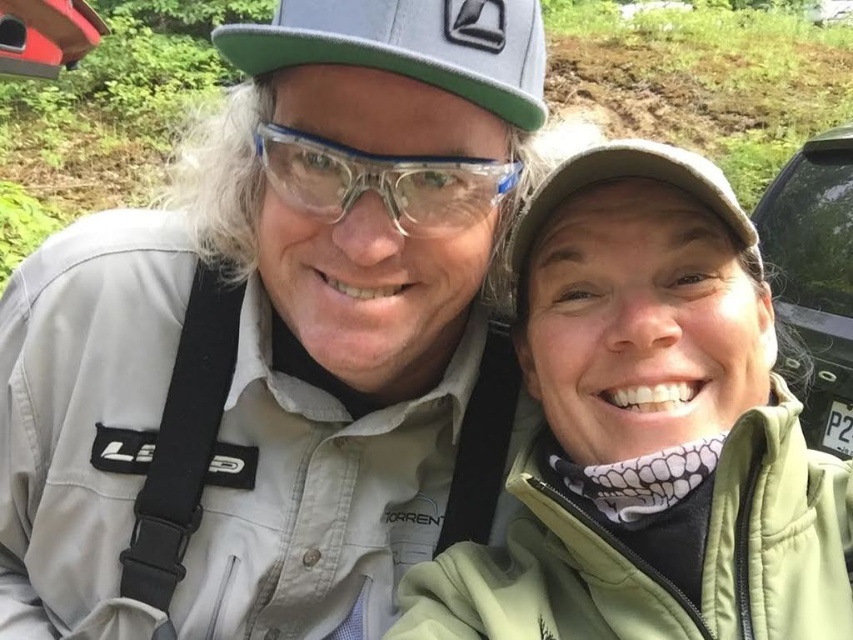
You are planning to take a road trip and need to decide which vehicle to use. You see the matte khaki jacket at left and the green matte car at right in the image. Which one is more suitable for carrying your luggage?

The green matte car at right is more suitable for carrying luggage because it has a larger size compared to the matte khaki jacket at left.